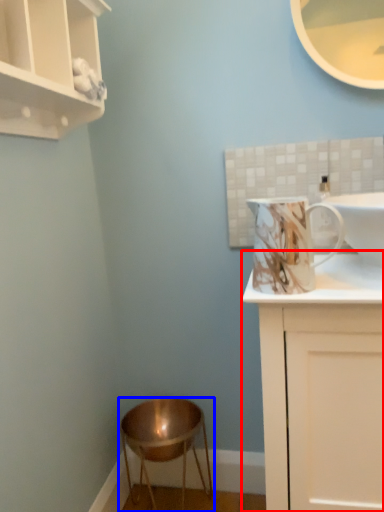
Question: Which object is further to the camera taking this photo, cabinetry (highlighted by a red box) or stool (highlighted by a blue box)?

Choices:
 (A) cabinetry
 (B) stool

Answer: (B)